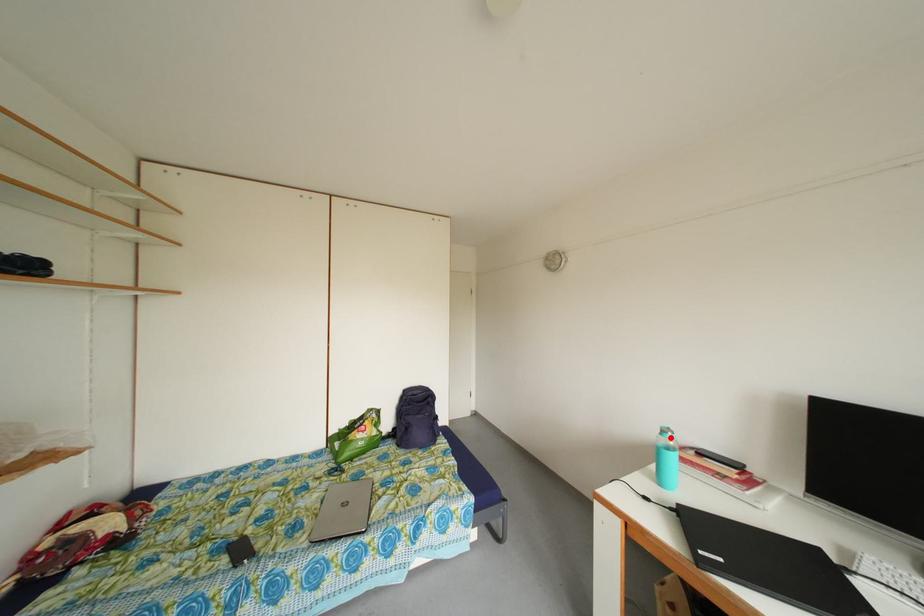
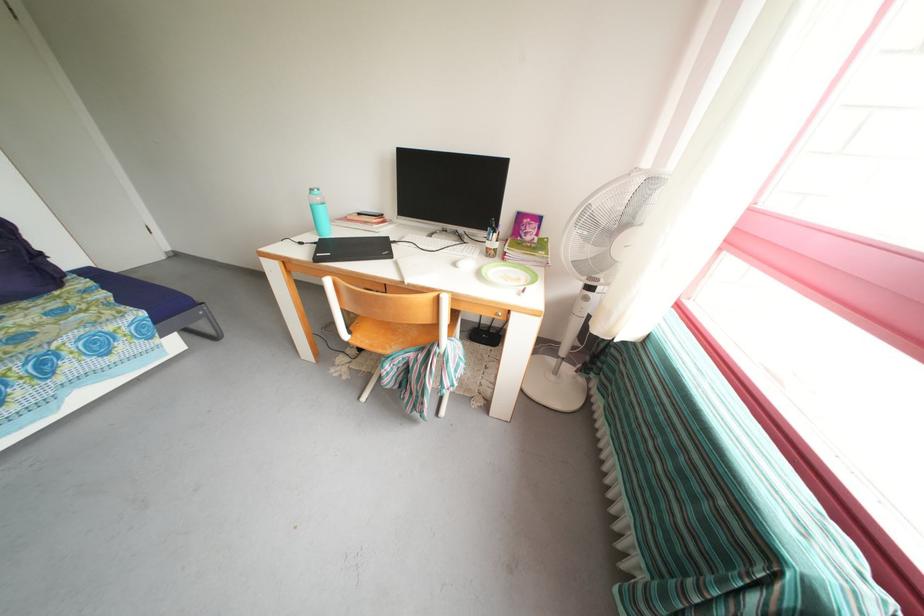
Question: I am providing you with two images of the same scene from different viewpoints. In image1, a red point is highlighted. Considering the same 3D point in image2, which of the following is correct?

Choices:
 (A) It is closer
 (B) It is farther

Answer: (A)